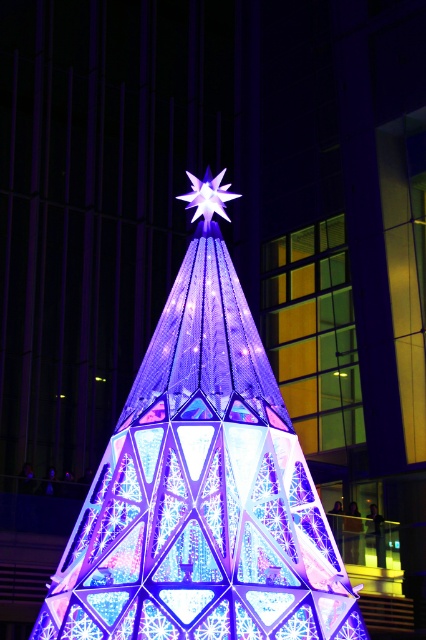
Question: Which of the following is the farthest from the observer?

Choices:
 (A) iridescent glass christmas tree at center
 (B) iridescent glass star at center

Answer: (B)

Question: Is iridescent glass christmas tree at center to the left of iridescent glass star at center from the viewer's perspective?

Choices:
 (A) yes
 (B) no

Answer: (B)

Question: Is iridescent glass christmas tree at center behind iridescent glass star at center?

Choices:
 (A) no
 (B) yes

Answer: (A)

Question: Which of the following is the closest to the observer?

Choices:
 (A) iridescent glass star at center
 (B) iridescent glass christmas tree at center

Answer: (B)

Question: Is iridescent glass christmas tree at center to the left of iridescent glass star at center from the viewer's perspective?

Choices:
 (A) yes
 (B) no

Answer: (B)